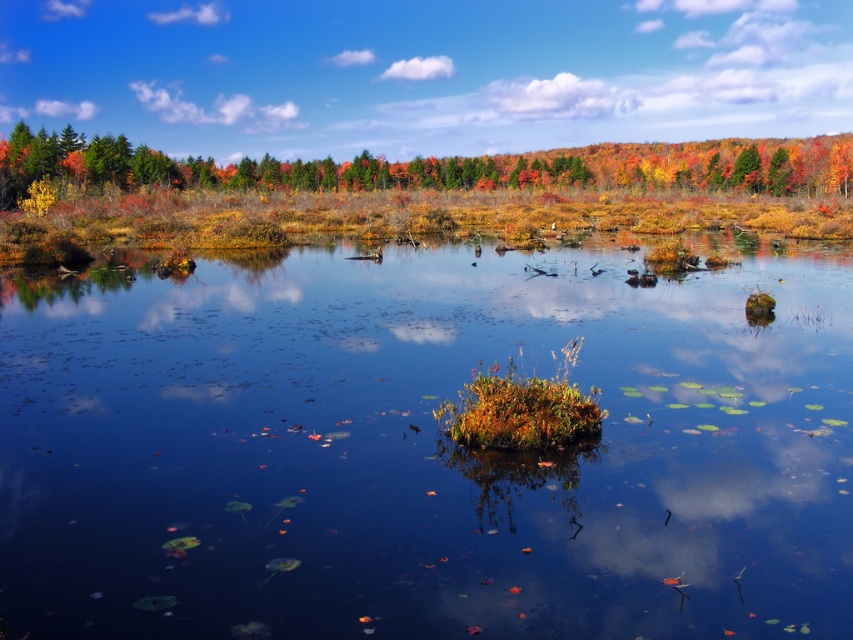
Question: Which object appears closest to the camera in this image?

Choices:
 (A) autumn foliage at upper center
 (B) green matte tree at upper right

Answer: (A)

Question: Is green mossy rock at center above green matte tree at upper right?

Choices:
 (A) yes
 (B) no

Answer: (B)

Question: Which object is positioned farthest from the green matte tree at upper right?

Choices:
 (A) green mossy rock at center
 (B) autumn foliage at upper center

Answer: (A)

Question: Does autumn foliage at upper center lie behind green matte tree at upper right?

Choices:
 (A) yes
 (B) no

Answer: (B)

Question: Estimate the real-world distances between objects in this image. Which object is farther from the orange autumn leaves at upper right?

Choices:
 (A) green mossy rock at center
 (B) green matte tree at upper right

Answer: (A)

Question: Is green mossy rock at center wider than green matte tree at upper right?

Choices:
 (A) yes
 (B) no

Answer: (A)